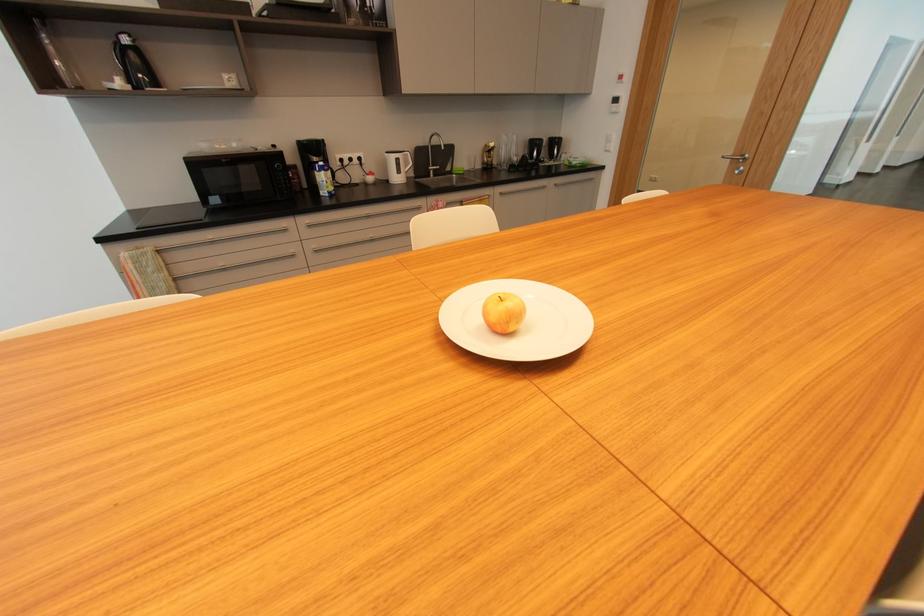
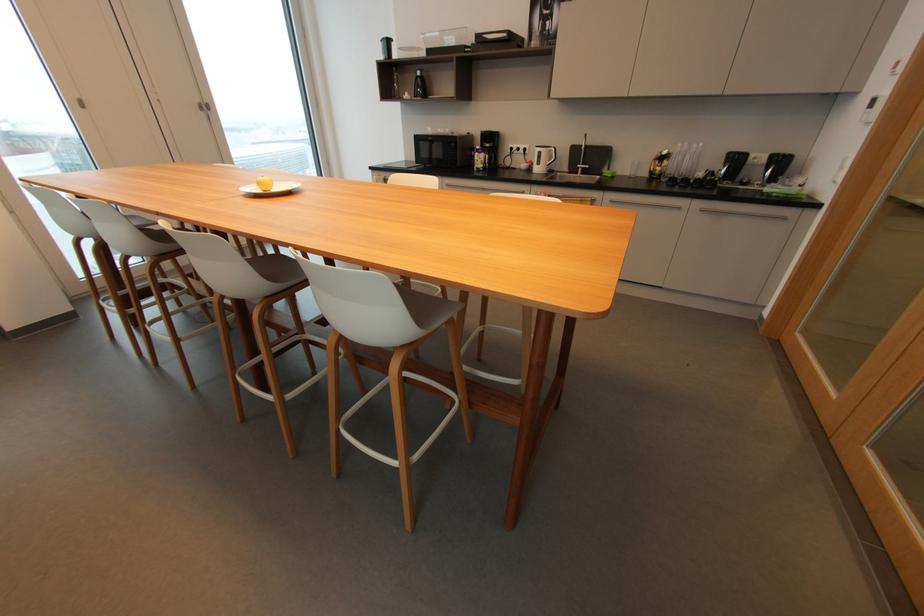
Find the pixel in the second image that matches point 495,152 in the first image.

(669, 161)